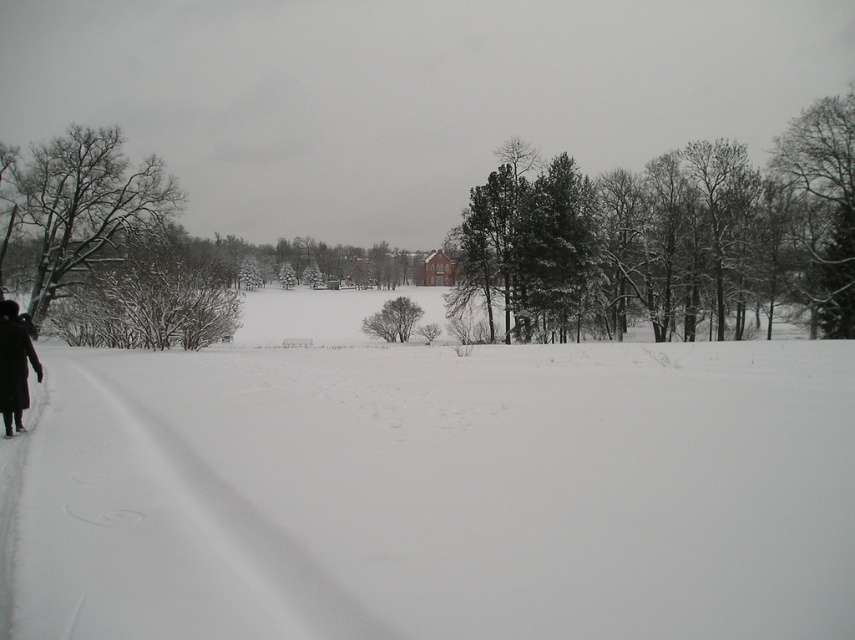
You are standing in the winter scene and see the white snow at left and the black matte coat at left. Which object is closer to the ground?

The white snow at left is closer to the ground because it is located below the black matte coat at left.

You are standing at the camera position and want to walk to the white snow at left. Is the distance less than 4 meters?

The distance between the white snow at left and the camera is 4.01 meters, which is slightly more than 4 meters. Therefore, the distance is not less than 4 meters.